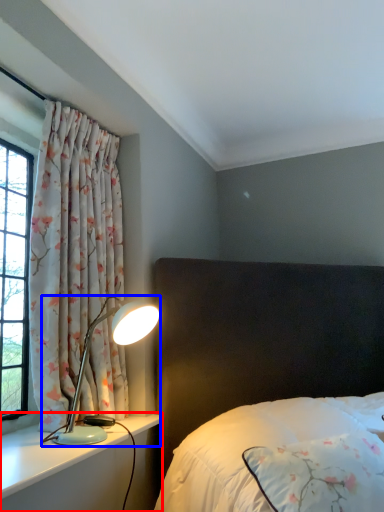
Question: Which point is further to the camera, dresser (highlighted by a red box) or lamp (highlighted by a blue box)?

Choices:
 (A) dresser
 (B) lamp

Answer: (B)